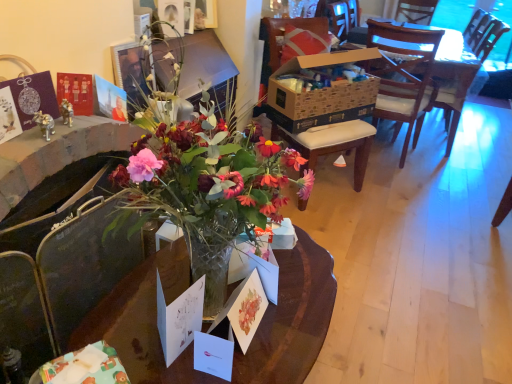
This screenshot has width=512, height=384. Identify the location of white paper postcard at center, which appears as the second postcard when viewed from the left. (214, 354).

This screenshot has width=512, height=384. Describe the element at coordinates (172, 13) in the screenshot. I see `matte wooden picture frame at upper center` at that location.

Measure the distance between wooden cushioned chair at center and camera.

A distance of 2.52 meters exists between wooden cushioned chair at center and camera.

You are a GUI agent. You are given a task and a screenshot of the screen. Output one action in this format:
    pyautogui.click(x=<x>, y=<y>)
    Task: Click on the translucent glass vase at center
    
    Given the screenshot: What is the action you would take?
    pyautogui.click(x=292, y=318)

Is matte paper postcard at center, which appears as the 1th postcard when viewed from the right, closer to the viewer compared to wooden cushioned chair at center?

Yes, it is in front of wooden cushioned chair at center.

From the image's perspective, between matte paper postcard at center, which appears as the 1th postcard when viewed from the right, and wooden cushioned chair at center, who is located below?

matte paper postcard at center, which appears as the 1th postcard when viewed from the right, is shown below in the image.

Based on the photo, considering the relative sizes of matte paper postcard at center, which appears as the 1th postcard when viewed from the right, and wooden cushioned chair at center in the image provided, is matte paper postcard at center, which appears as the 1th postcard when viewed from the right, wider than wooden cushioned chair at center?

No.

Is wooden cushioned chair at center at the back of matte paper postcard at center, which appears as the 1th postcard when viewed from the right?

No, wooden cushioned chair at center is not at the back of matte paper postcard at center, which appears as the 1th postcard when viewed from the right.

Would you say matte wooden picture frame at upper center is part of white paper postcard at center, the 2th postcard in the right-to-left sequence,'s contents?

Actually, matte wooden picture frame at upper center is outside white paper postcard at center, the 2th postcard in the right-to-left sequence.

In terms of size, does white paper postcard at center, the 2th postcard in the right-to-left sequence, appear bigger or smaller than matte wooden picture frame at upper center?

Considering their sizes, white paper postcard at center, the 2th postcard in the right-to-left sequence, takes up less space than matte wooden picture frame at upper center.

Is white paper postcard at center, which appears as the second postcard when viewed from the left, far away from matte wooden picture frame at upper center?

white paper postcard at center, which appears as the second postcard when viewed from the left, is far away from matte wooden picture frame at upper center.

From the image's perspective, is wooden armchair at center over white paper postcard at center, which appears as the second postcard when viewed from the left?

Yes, from the image's perspective, wooden armchair at center is over white paper postcard at center, which appears as the second postcard when viewed from the left.

Is wooden armchair at center behind white paper postcard at center, the 2th postcard in the right-to-left sequence?

Yes, wooden armchair at center is behind white paper postcard at center, the 2th postcard in the right-to-left sequence.

Is wooden armchair at center surrounding white paper postcard at center, the 2th postcard in the right-to-left sequence?

No, white paper postcard at center, the 2th postcard in the right-to-left sequence, is not inside wooden armchair at center.

Can we say wooden cushioned chair at center lies outside matte paper postcard at center, which appears as the 1th postcard when viewed from the right?

Yes, wooden cushioned chair at center is located beyond the bounds of matte paper postcard at center, which appears as the 1th postcard when viewed from the right.

Considering the relative positions of wooden cushioned chair at center and matte paper postcard at center, the third postcard when ordered from left to right, in the image provided, is wooden cushioned chair at center to the right of matte paper postcard at center, the third postcard when ordered from left to right, from the viewer's perspective?

Correct, you'll find wooden cushioned chair at center to the right of matte paper postcard at center, the third postcard when ordered from left to right.

From the image's perspective, is wooden cushioned chair at center located above matte paper postcard at center, the third postcard when ordered from left to right?

Yes, from the image's perspective, wooden cushioned chair at center is above matte paper postcard at center, the third postcard when ordered from left to right.

How much distance is there between wooden cushioned chair at center and matte paper postcard at center, which appears as the 1th postcard when viewed from the right?

wooden cushioned chair at center is 5.89 feet away from matte paper postcard at center, which appears as the 1th postcard when viewed from the right.

Is wooden armchair at center thinner than matte wooden picture frame at upper center?

Incorrect, the width of wooden armchair at center is not less than that of matte wooden picture frame at upper center.

Identify the location of picture frame in front of the wooden armchair at center. point(172,13).

Is point (469, 55) closer or farther from the camera than point (183, 30)?

Point (469, 55) is positioned farther from the camera compared to point (183, 30).

From a real-world perspective, which is physically below, white paper postcard at center, which appears as the second postcard when viewed from the left, or white paper postcard at center, marked as the 3th postcard in a right-to-left arrangement?

white paper postcard at center, which appears as the second postcard when viewed from the left, from a real-world perspective.

Which object is wider, white paper postcard at center, the 2th postcard in the right-to-left sequence, or white paper postcard at center, marked as the 3th postcard in a right-to-left arrangement?

With larger width is white paper postcard at center, marked as the 3th postcard in a right-to-left arrangement.

Does white paper postcard at center, which appears as the second postcard when viewed from the left, have a larger size compared to white paper postcard at center, marked as the 3th postcard in a right-to-left arrangement?

No, white paper postcard at center, which appears as the second postcard when viewed from the left, is not bigger than white paper postcard at center, marked as the 3th postcard in a right-to-left arrangement.

Is white paper postcard at center, which appears as the second postcard when viewed from the left, at the right side of white paper postcard at center, which is the 1th postcard from left to right?

Correct, you'll find white paper postcard at center, which appears as the second postcard when viewed from the left, to the right of white paper postcard at center, which is the 1th postcard from left to right.

Is translucent glass vase at center not inside brown cardboard box at center, the 1th box positioned from the right?

Yes, translucent glass vase at center is located beyond the bounds of brown cardboard box at center, the 1th box positioned from the right.

Which object is further away from the camera taking this photo, translucent glass vase at center or brown cardboard box at center, which is the second box from bottom to top?

Positioned behind is brown cardboard box at center, which is the second box from bottom to top.

Which of these two, translucent glass vase at center or brown cardboard box at center, placed as the 2th box when sorted from left to right, is bigger?

With larger size is translucent glass vase at center.

The image size is (512, 384). I want to click on chair on the right of matte paper postcard at center, which appears as the 1th postcard when viewed from the right, so click(x=283, y=35).

Starting from the matte wooden picture frame at upper center, which postcard is the 3rd one in front? Please provide its 2D coordinates.

[(214, 354)]

From the image, which object appears to be farther from translucent glass vase at center, wooden armchair at center or brown cardboard box at center, which is the second box from bottom to top?

wooden armchair at center is positioned further to the anchor translucent glass vase at center.

Looking at the image, which one is located closer to translucent glass vase at center, white paper postcard at center, marked as the 3th postcard in a right-to-left arrangement, or matte paper postcard at center, the third postcard when ordered from left to right?

matte paper postcard at center, the third postcard when ordered from left to right.

Based on the photo, from the image, which object appears to be farther from wooden armchair at center, wooden cushioned chair at center or translucent glass vase at center?

Based on the image, translucent glass vase at center appears to be further to wooden armchair at center.

From the image, which object appears to be nearer to translucent glass vase at center, white matte box at center, positioned as the 1th box in front-to-back order, or brown cardboard box at center, placed as the 2th box when sorted from left to right?

white matte box at center, positioned as the 1th box in front-to-back order, lies closer to translucent glass vase at center than the other object.

When comparing their distances from white paper postcard at center, marked as the 3th postcard in a right-to-left arrangement, does white paper postcard at center, which appears as the second postcard when viewed from the left, or brown cardboard box at center, the 1th box positioned from the right, seem closer?

white paper postcard at center, which appears as the second postcard when viewed from the left, is closer to white paper postcard at center, marked as the 3th postcard in a right-to-left arrangement.

Considering their positions, is matte wooden picture frame at upper center positioned further to white paper postcard at center, which is the 1th postcard from left to right, than white matte box at center, placed as the first box when sorted from left to right?

matte wooden picture frame at upper center is further to white paper postcard at center, which is the 1th postcard from left to right.

Considering their positions, is brown cardboard box at center, which is the 1th box in back-to-front order, positioned closer to matte paper postcard at center, which appears as the 1th postcard when viewed from the right, than white matte box at center, positioned as the 1th box in front-to-back order?

Based on the image, white matte box at center, positioned as the 1th box in front-to-back order, appears to be nearer to matte paper postcard at center, which appears as the 1th postcard when viewed from the right.

Based on their spatial positions, is wooden cushioned chair at center or brown cardboard box at center, which is the 1th box in back-to-front order, further from wooden armchair at center?

wooden cushioned chair at center is further to wooden armchair at center.

Find the location of a particular element. chair positioned between matte paper postcard at center, the third postcard when ordered from left to right, and wooden armchair at center from near to far is located at coordinates (283, 35).

The image size is (512, 384). What are the coordinates of `picture frame between translucent glass vase at center and brown cardboard box at center, the 1th box positioned from the right, along the z-axis` in the screenshot? It's located at (172, 13).

Locate an element on the screen. picture frame positioned between white paper postcard at center, which is the 1th postcard from left to right, and wooden cushioned chair at center from near to far is located at coordinates (172, 13).

At what (x,y) coordinates should I click in order to perform the action: click on chair between white paper postcard at center, marked as the 3th postcard in a right-to-left arrangement, and wooden armchair at center in the front-back direction. Please return your answer as a coordinate pair (x, y). The height and width of the screenshot is (384, 512). Looking at the image, I should click on (283, 35).